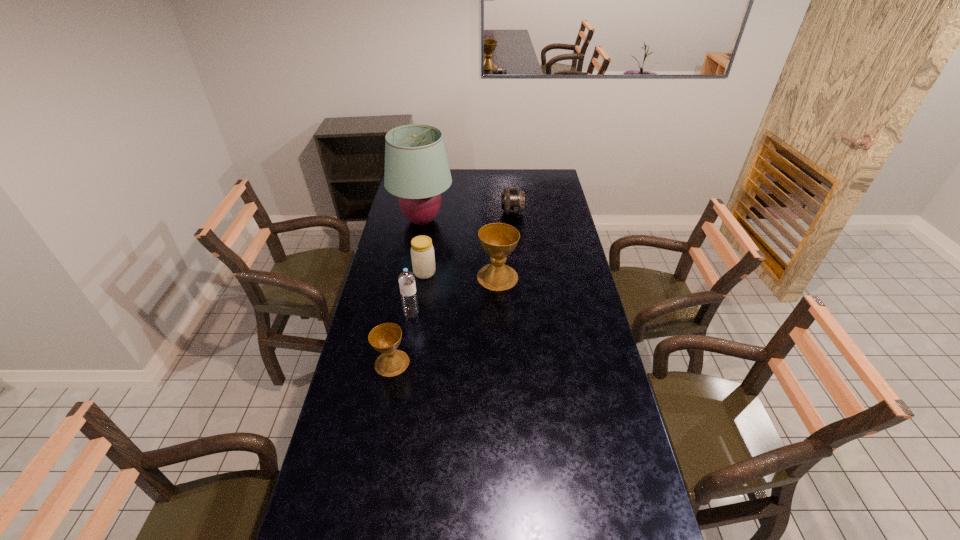
At what (x,y) coordinates should I click in order to perform the action: click on free spot between the water bottle and the nearest object. Please return your answer as a coordinate pair (x, y). The width and height of the screenshot is (960, 540). Looking at the image, I should click on (402, 338).

Choose which object is the second nearest neighbor to the jar. Please provide its 2D coordinates. Your answer should be formatted as a tuple, i.e. [(x, y)], where the tuple contains the x and y coordinates of a point satisfying the conditions above.

[(498, 240)]

Where is `object that is the fourth closest to the second nearest object`? This screenshot has height=540, width=960. object that is the fourth closest to the second nearest object is located at coordinates pyautogui.click(x=417, y=171).

The image size is (960, 540). I want to click on vacant region that satisfies the following two spatial constraints: 1. on the front side of the jar; 2. on the left side of the right chalice, so click(x=424, y=277).